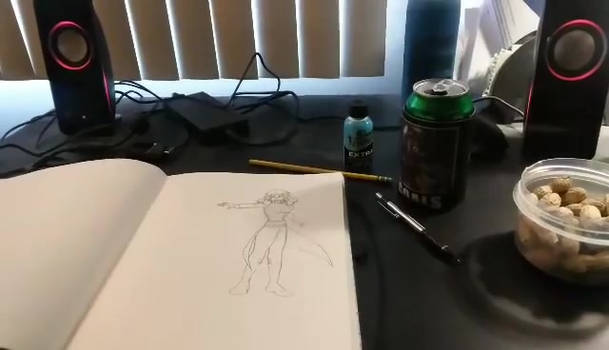
In order to click on vertical blinds in this screenshot , I will do `click(359, 31)`.